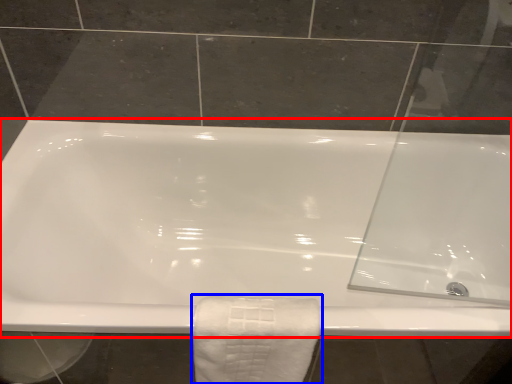
Question: Among these objects, which one is nearest to the camera, bathtub (highlighted by a red box) or towel (highlighted by a blue box)?

Choices:
 (A) bathtub
 (B) towel

Answer: (B)